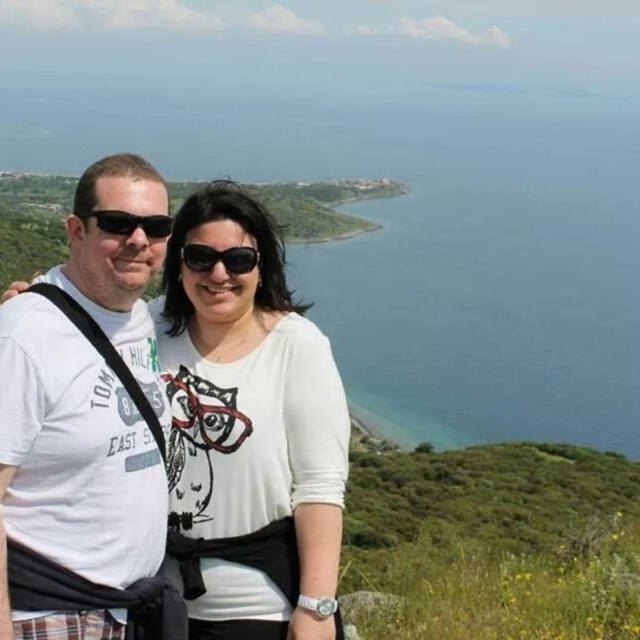
In the scene shown: You are a photographer trying to capture a photo of the blue water at center and the white matte shirt at center. Based on their positions, which object is higher in the image?

The blue water at center is located above the white matte shirt at center, so the blue water at center is higher in the image.

You are a photographer trying to adjust the focus on your camera. You want to ensure that both the white matte shirt at center and the black plastic sunglasses at left are in clear focus. Given their sizes, which object should you prioritize focusing on first?

The white matte shirt at center is larger in size than the black plastic sunglasses at left, so you should prioritize focusing on the white matte shirt at center first as larger objects generally require more precise focus to ensure clarity.

You are a photographer trying to capture the best shot of the scene. You notice a point at coordinates (250, 428) in the image. What object is located at that point?

The point at coordinates (250, 428) corresponds to the white matte shirt at center.